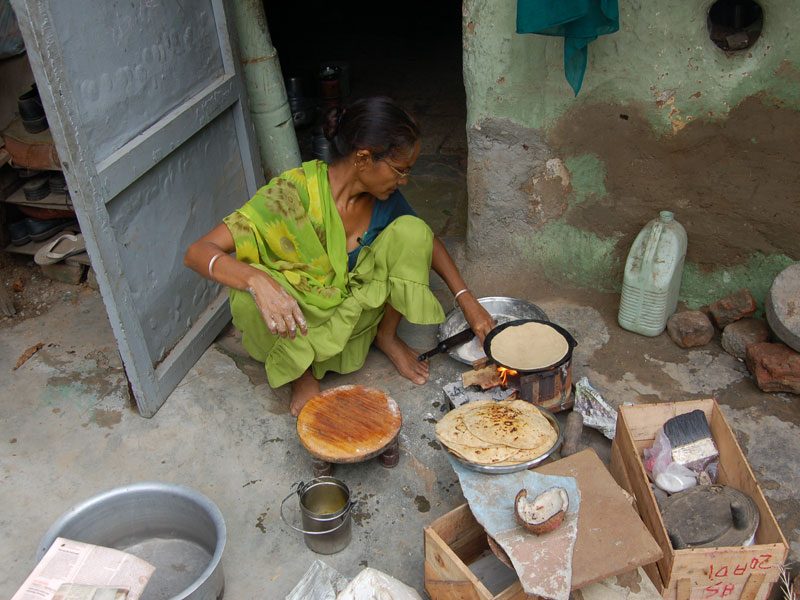
Find the location of a particular element. rolling pin is located at coordinates (453, 349).